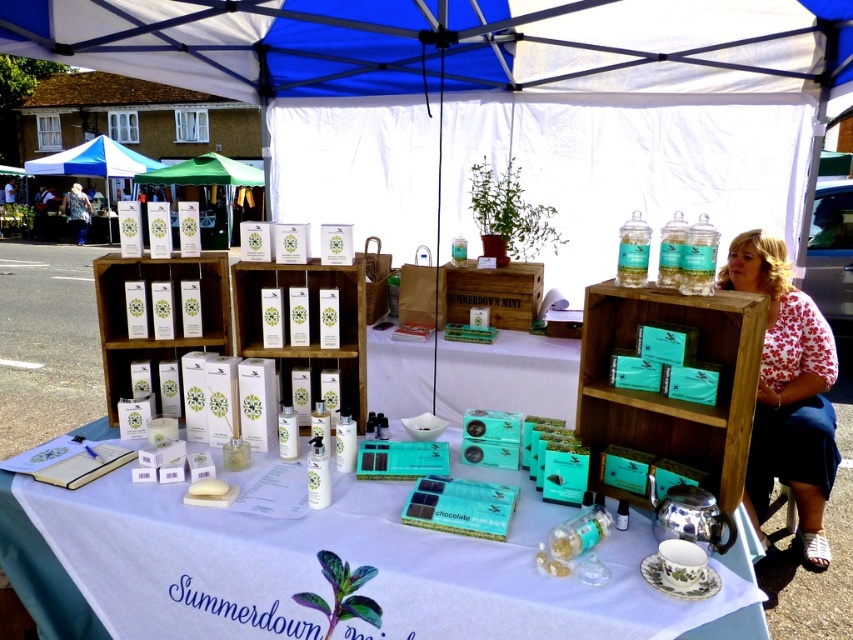
Question: Does blue fabric canopy at upper center appear over white glossy table at center?

Choices:
 (A) yes
 (B) no

Answer: (A)

Question: Which object appears farthest from the camera in this image?

Choices:
 (A) white glossy table at center
 (B) white floral shirt at upper right

Answer: (B)

Question: Which point is farther to the camera?

Choices:
 (A) white floral shirt at upper right
 (B) blue fabric canopy at upper center

Answer: (B)

Question: Can you confirm if blue fabric canopy at upper center is positioned above white floral shirt at upper right?

Choices:
 (A) no
 (B) yes

Answer: (B)

Question: Which of these objects is positioned closest to the white glossy table at center?

Choices:
 (A) blue fabric canopy at upper center
 (B) white floral shirt at upper right

Answer: (B)

Question: Is white floral shirt at upper right wider than white glossy table at center?

Choices:
 (A) yes
 (B) no

Answer: (A)